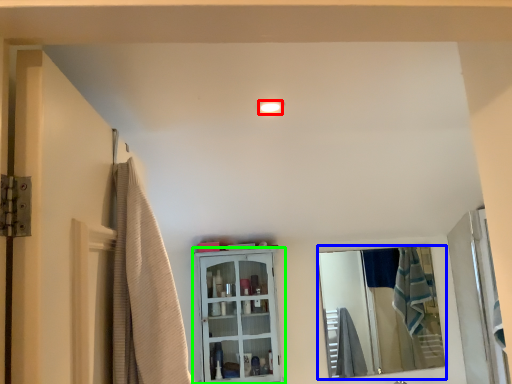
Question: Considering the real-world distances, which object is closest to light fixture (highlighted by a red box)? mirror (highlighted by a blue box) or cabinetry (highlighted by a green box).

Choices:
 (A) mirror
 (B) cabinetry

Answer: (B)